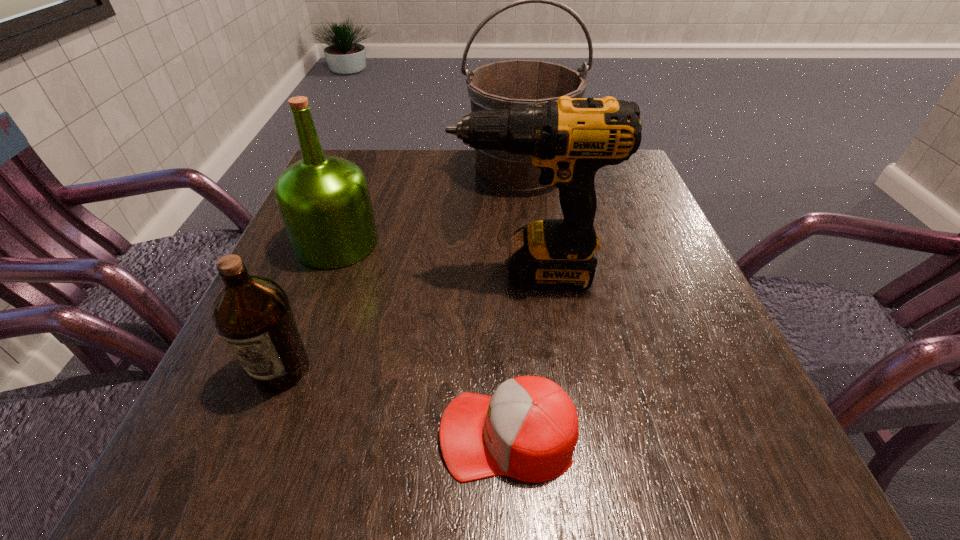
Where is `free space at the far edge`? The image size is (960, 540). free space at the far edge is located at coordinates (435, 193).

Image resolution: width=960 pixels, height=540 pixels. I want to click on vacant area at the near edge of the desktop, so click(x=566, y=475).

The width and height of the screenshot is (960, 540). In the image, there is a desktop. In order to click on free space at the left edge in this screenshot , I will do `click(305, 293)`.

The width and height of the screenshot is (960, 540). What are the coordinates of `vacant space at the right edge of the desktop` in the screenshot? It's located at (732, 392).

Locate an element on the screen. The image size is (960, 540). free point at the near left corner is located at coordinates (190, 451).

Locate an element on the screen. Image resolution: width=960 pixels, height=540 pixels. free space at the far right corner is located at coordinates (635, 165).

Locate an element on the screen. The width and height of the screenshot is (960, 540). vacant area that lies between the nearer olive oil and the shortest object is located at coordinates (395, 402).

Identify the location of vacant space that's between the farthest object and the drill. This screenshot has width=960, height=540. (524, 223).

At what (x,y) coordinates should I click in order to perform the action: click on free space between the drill and the shortest object. Please return your answer as a coordinate pair (x, y). This screenshot has width=960, height=540. Looking at the image, I should click on (517, 354).

Identify the location of unoccupied position between the shorter olive oil and the baseball cap. (395, 402).